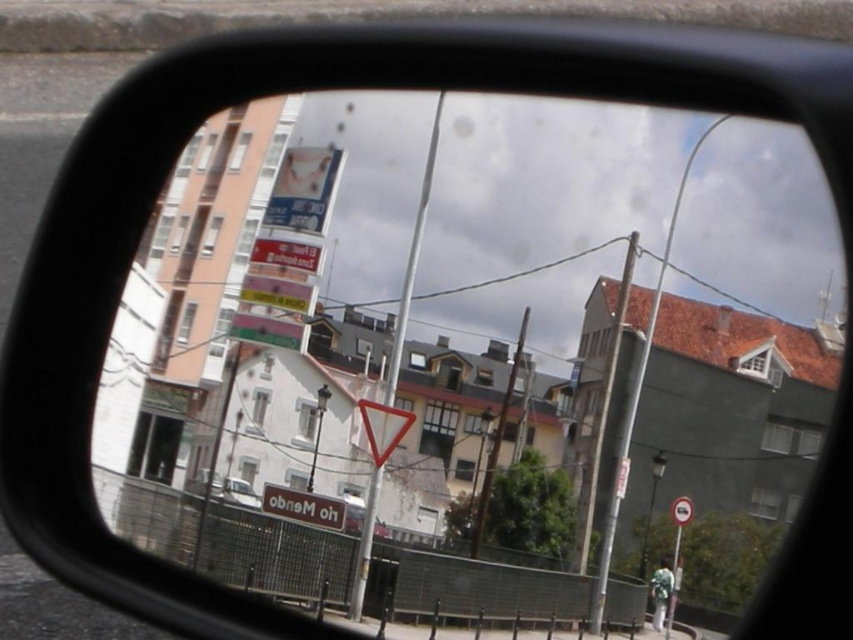
You are a driver checking your side mirror and see the image described. You notice a point at coordinates (303, 506) in the mirror. What object does this point correspond to?

The point at coordinates (303, 506) corresponds to the white plastic traffic sign at center.